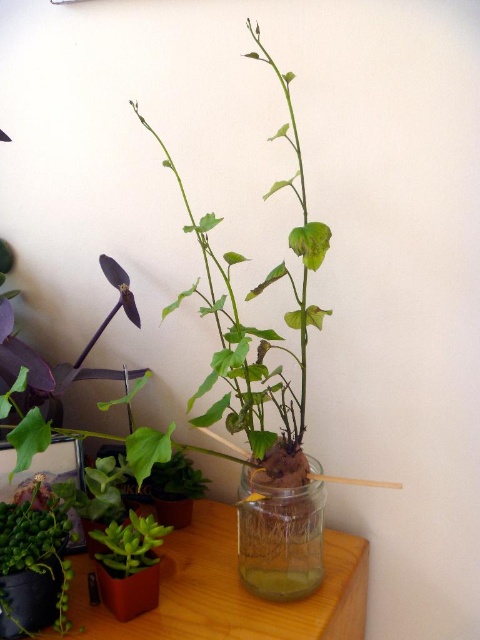
Which is more to the left, green glossy succulent at lower left or green matte succulent at lower left?

green glossy succulent at lower left is more to the left.

Can you confirm if green glossy succulent at lower left is smaller than green matte succulent at lower left?

No.

Is point (36, 490) closer to camera compared to point (106, 563)?

No, it is not.

You are a GUI agent. You are given a task and a screenshot of the screen. Output one action in this format:
    pyautogui.click(x=<x>, y=<y>)
    Task: Click on the green glossy succulent at lower left
    The width and height of the screenshot is (480, 640).
    Given the screenshot: What is the action you would take?
    pyautogui.click(x=34, y=566)

The width and height of the screenshot is (480, 640). What do you see at coordinates (228, 592) in the screenshot?
I see `wooden table at center` at bounding box center [228, 592].

Is wooden table at center closer to the viewer compared to green glossy succulent at lower left?

No, it is behind green glossy succulent at lower left.

Is point (217, 634) positioned in front of point (1, 602)?

No, it is not.

Locate an element on the screen. wooden table at center is located at coordinates (228, 592).

Can you confirm if green matte plant at center is shorter than green matte succulent at lower left?

No, green matte plant at center is not shorter than green matte succulent at lower left.

I want to click on green matte plant at center, so click(x=252, y=298).

This screenshot has height=640, width=480. What do you see at coordinates (252, 298) in the screenshot?
I see `green matte plant at center` at bounding box center [252, 298].

Where is `green matte plant at center`? Image resolution: width=480 pixels, height=640 pixels. green matte plant at center is located at coordinates (252, 298).